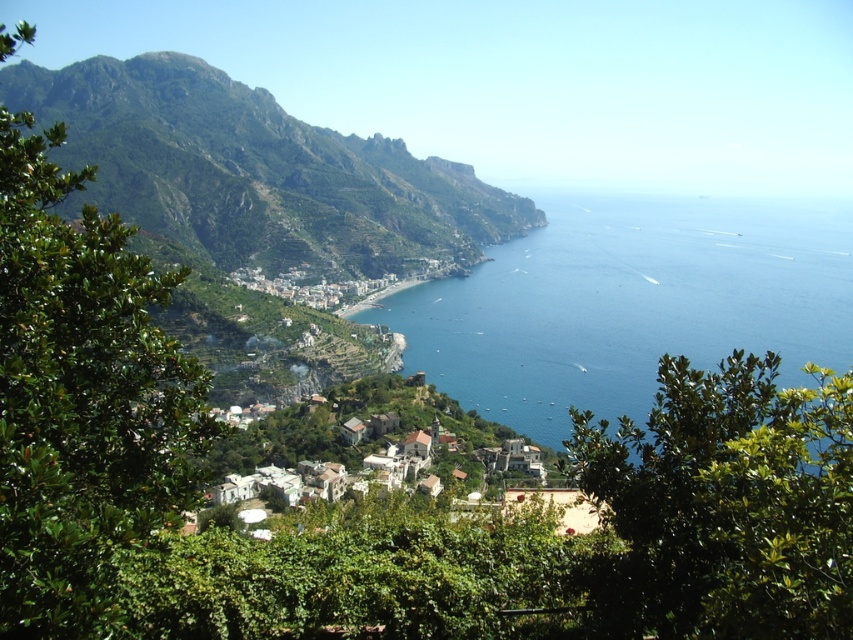
Can you confirm if blue liquid water at center is taller than green rocky mountain at upper left?

No.

Is blue liquid water at center further to camera compared to green rocky mountain at upper left?

No, it is not.

Where is `blue liquid water at center`? blue liquid water at center is located at coordinates (628, 305).

Is green leafy tree at lower right bigger than white stucco houses at center?

No.

Measure the distance between point [776,396] and camera.

Point [776,396] and camera are 177.07 feet apart from each other.

Does point (764, 525) come closer to viewer compared to point (294, 445)?

Yes, point (764, 525) is in front of point (294, 445).

Identify the location of green leafy tree at lower right. The width and height of the screenshot is (853, 640). (726, 504).

Can you confirm if green leafy tree at left is bigger than green rocky mountain at upper left?

No.

Is green leafy tree at left to the left of green rocky mountain at upper left from the viewer's perspective?

In fact, green leafy tree at left is to the right of green rocky mountain at upper left.

Between point (41, 522) and point (173, 157), which one is positioned in front?

Point (41, 522)

Locate an element on the screen. green leafy tree at left is located at coordinates (80, 397).